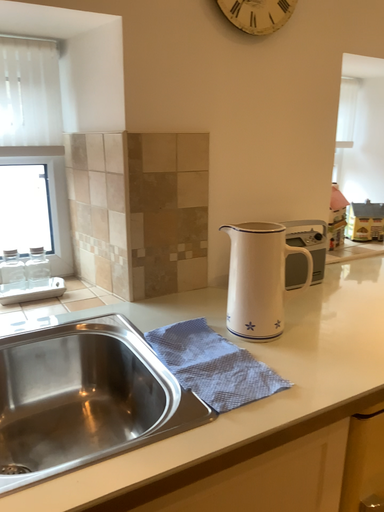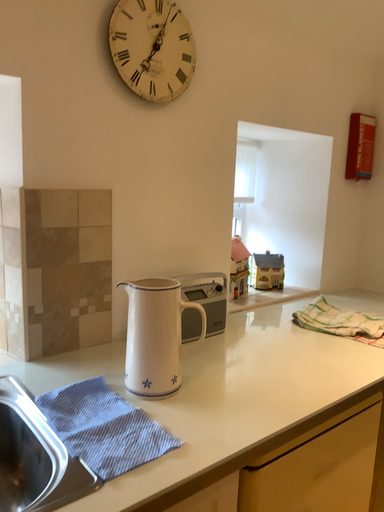
Question: Which way did the camera rotate in the video?

Choices:
 (A) rotated left
 (B) rotated right

Answer: (B)